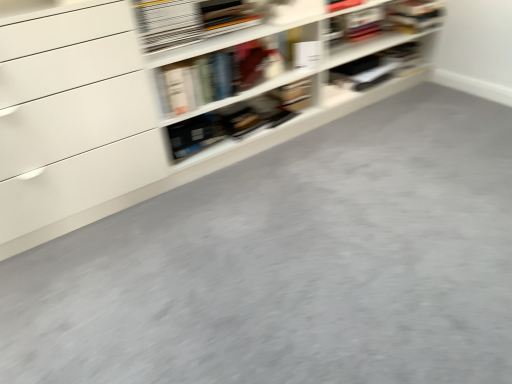
Question: Considering the relative sizes of white matte shelf at upper center and matte black book at upper center, marked as the second book in a front-to-back arrangement, in the image provided, is white matte shelf at upper center bigger than matte black book at upper center, marked as the second book in a front-to-back arrangement,?

Choices:
 (A) no
 (B) yes

Answer: (B)

Question: From the image's perspective, is white matte shelf at upper center on top of matte black book at upper center, marked as the second book in a front-to-back arrangement?

Choices:
 (A) no
 (B) yes

Answer: (A)

Question: From the image's perspective, would you say white matte shelf at upper center is shown under matte black book at upper center, marked as the 1th book in a back-to-front arrangement?

Choices:
 (A) yes
 (B) no

Answer: (A)

Question: Considering the relative positions of white matte shelf at upper center and matte black book at upper center, marked as the second book in a front-to-back arrangement, in the image provided, is white matte shelf at upper center in front of matte black book at upper center, marked as the second book in a front-to-back arrangement,?

Choices:
 (A) no
 (B) yes

Answer: (B)

Question: Is white matte shelf at upper center to the right of matte black book at upper center, which is the 1th book from right to left, from the viewer's perspective?

Choices:
 (A) no
 (B) yes

Answer: (A)

Question: Considering the positions of matte black book at upper center, marked as the 1th book in a back-to-front arrangement, and hardcover book at upper center, which is the first book from front to back, in the image, is matte black book at upper center, marked as the 1th book in a back-to-front arrangement, taller or shorter than hardcover book at upper center, which is the first book from front to back,?

Choices:
 (A) tall
 (B) short

Answer: (A)

Question: From the image's perspective, relative to hardcover book at upper center, the 2th book viewed from the right, is matte black book at upper center, marked as the 1th book in a back-to-front arrangement, above or below?

Choices:
 (A) below
 (B) above

Answer: (A)

Question: Considering the relative positions of matte black book at upper center, placed as the 2th book when sorted from left to right, and hardcover book at upper center, the 2th book viewed from the right, in the image provided, is matte black book at upper center, placed as the 2th book when sorted from left to right, to the left or to the right of hardcover book at upper center, the 2th book viewed from the right,?

Choices:
 (A) right
 (B) left

Answer: (A)

Question: Relative to hardcover book at upper center, which ranks as the 1th book in left-to-right order, is matte black book at upper center, placed as the 2th book when sorted from left to right, in front or behind?

Choices:
 (A) front
 (B) behind

Answer: (B)

Question: Does point (380, 64) appear closer or farther from the camera than point (165, 105)?

Choices:
 (A) closer
 (B) farther

Answer: (B)

Question: In terms of size, does matte black book at upper center, placed as the 2th book when sorted from left to right, appear bigger or smaller than white matte shelf at upper center?

Choices:
 (A) big
 (B) small

Answer: (B)

Question: Is matte black book at upper center, marked as the second book in a front-to-back arrangement, to the left or to the right of white matte shelf at upper center in the image?

Choices:
 (A) right
 (B) left

Answer: (A)

Question: Is matte black book at upper center, marked as the 1th book in a back-to-front arrangement, inside or outside of white matte shelf at upper center?

Choices:
 (A) outside
 (B) inside

Answer: (B)

Question: Choose the correct answer: Is hardcover book at upper center, the second book positioned from the back, inside white matte shelf at upper center or outside it?

Choices:
 (A) inside
 (B) outside

Answer: (A)

Question: Looking at their shapes, would you say hardcover book at upper center, which is the first book from front to back, is wider or thinner than white matte shelf at upper center?

Choices:
 (A) thin
 (B) wide

Answer: (A)